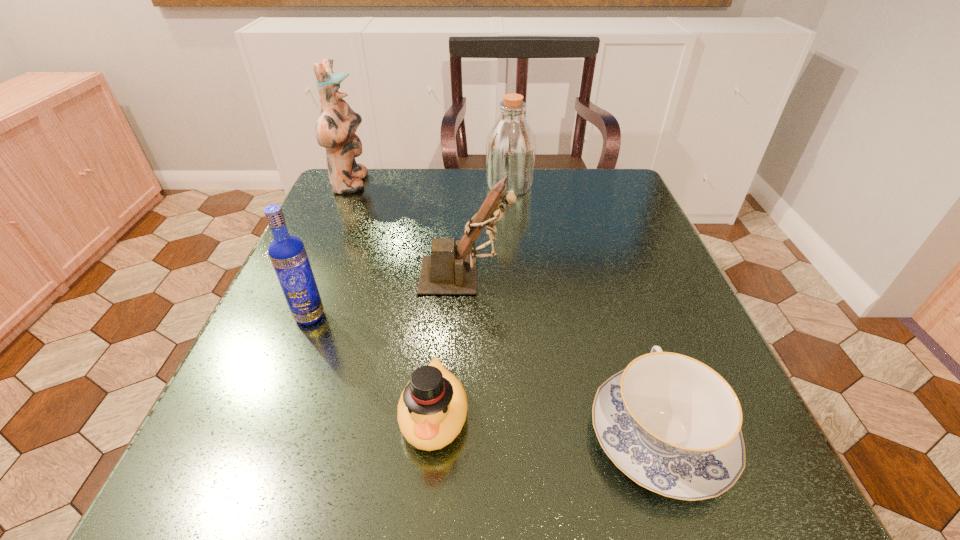
I want to click on the left figurine, so click(x=335, y=129).

Identify the location of the taller figurine. [x=335, y=129].

Identify the location of bottle. The image size is (960, 540). (511, 146).

You are a GUI agent. You are given a task and a screenshot of the screen. Output one action in this format:
    pyautogui.click(x=<x>, y=<y>)
    Task: Click on the vodka
    This screenshot has height=540, width=960.
    Given the screenshot: What is the action you would take?
    pyautogui.click(x=288, y=255)

Locate an element on the screen. The image size is (960, 540). the right figurine is located at coordinates (448, 271).

Where is `the third farthest object`? This screenshot has width=960, height=540. the third farthest object is located at coordinates (448, 271).

In order to click on duck in this screenshot , I will do `click(432, 409)`.

Where is `the shortest object`? the shortest object is located at coordinates (672, 424).

At what (x,y) coordinates should I click in order to perform the action: click on chinaware. Please return your answer as a coordinate pair (x, y). This screenshot has width=960, height=540. Looking at the image, I should click on (672, 424).

You are a GUI agent. You are given a task and a screenshot of the screen. Output one action in this format:
    pyautogui.click(x=<x>, y=<y>)
    Task: Click on the free spot located on the front-facing side of the tallest object
    This screenshot has width=960, height=540.
    Given the screenshot: What is the action you would take?
    pyautogui.click(x=452, y=184)